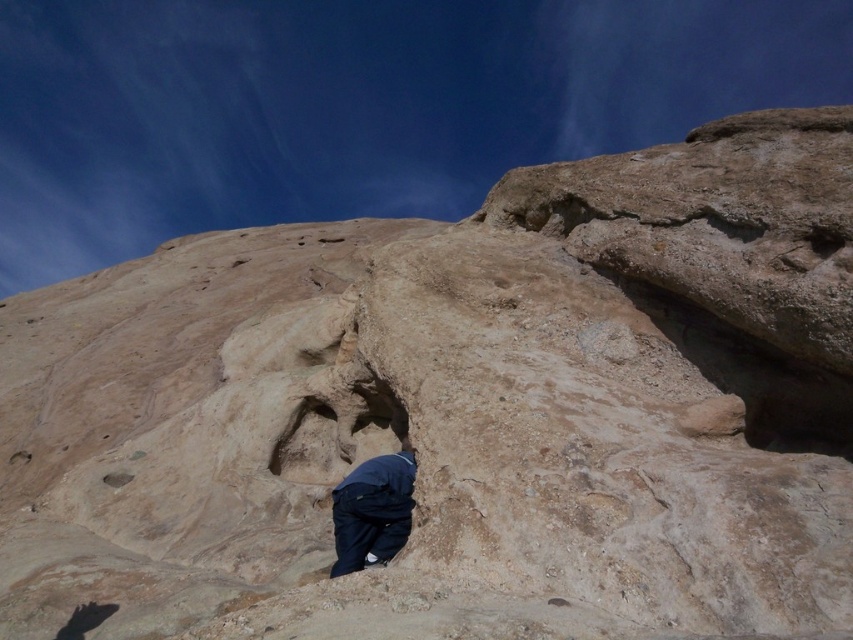
You are an explorer in the rugged landscape. You see the dark blue fabric at lower center and the brown rough hole at lower left. Which object is located to the right side of the other?

The dark blue fabric at lower center is located to the right of the brown rough hole at lower left.

You are a hiker trying to navigate through the rocky terrain. You notice the dark blue fabric at lower center and the smooth sandstone hole at upper right. Which object is narrower in width?

The dark blue fabric at lower center has a lesser width compared to the smooth sandstone hole at upper right, so the dark blue fabric at lower center is narrower in width.